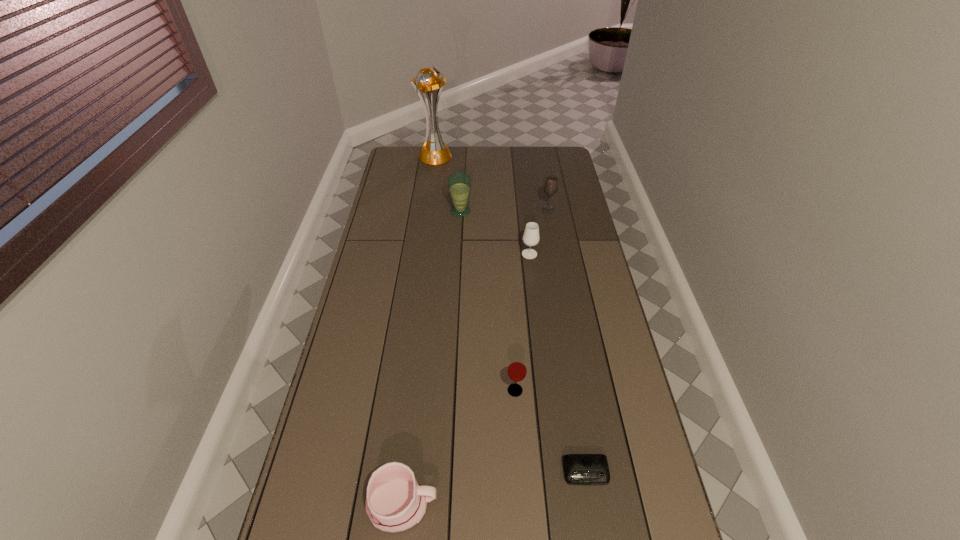
You are a GUI agent. You are given a task and a screenshot of the screen. Output one action in this format:
    pyautogui.click(x=<x>, y=<y>)
    Task: Click on the vacant area situated 0.190m on the front-facing side of the trophy
    The height and width of the screenshot is (540, 960).
    Given the screenshot: What is the action you would take?
    pyautogui.click(x=431, y=187)

The width and height of the screenshot is (960, 540). What are the coordinates of `free space located 0.310m on the front of the leftmost glass` in the screenshot? It's located at (458, 268).

Find the location of a particular element. The height and width of the screenshot is (540, 960). free region located 0.050m on the back of the rightmost glass is located at coordinates (546, 199).

Find the location of a particular element. blank space located on the back of the second glass from left to right is located at coordinates (511, 326).

At what (x,y) coordinates should I click in order to perform the action: click on free space located on the back of the third glass from left to right. Please return your answer as a coordinate pair (x, y). The height and width of the screenshot is (540, 960). Looking at the image, I should click on (523, 203).

At what (x,y) coordinates should I click in order to perform the action: click on vacant space located 0.330m on the side with the handle of the sixth tallest object. Please return your answer as a coordinate pair (x, y). The image size is (960, 540). Looking at the image, I should click on (571, 505).

Image resolution: width=960 pixels, height=540 pixels. What are the coordinates of `vacant area situated on the display of the alarm clock` in the screenshot? It's located at (595, 530).

At what (x,y) coordinates should I click in order to perform the action: click on object located at the far edge. Please return your answer as a coordinate pair (x, y). This screenshot has width=960, height=540. Looking at the image, I should click on (434, 152).

This screenshot has width=960, height=540. In order to click on object positioned at the left edge in this screenshot , I will do `click(434, 152)`.

Find the location of a particular element. The height and width of the screenshot is (540, 960). glass drink container located at the right edge is located at coordinates (551, 185).